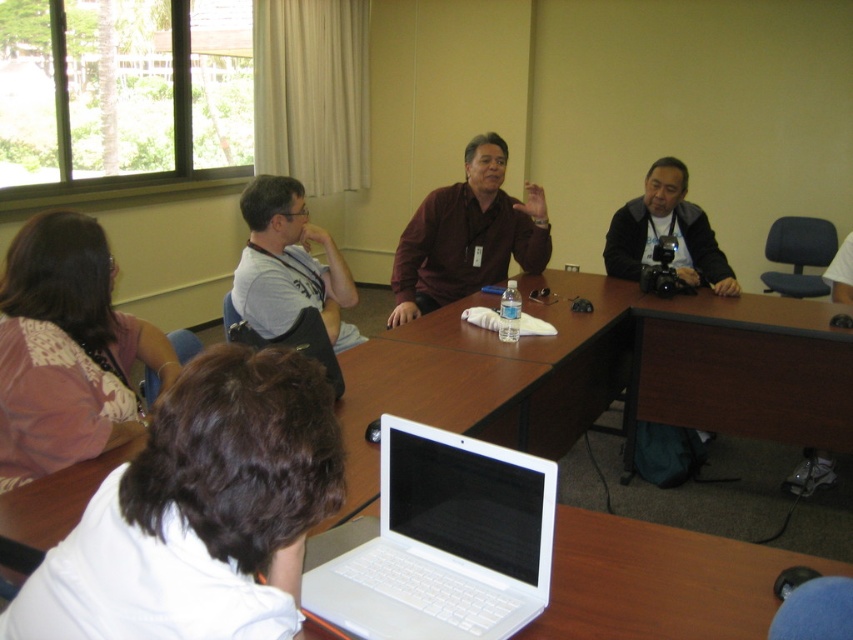
Is pink floral blouse at lower left further to the viewer compared to white matte t-shirt at center?

That is False.

Is point (3, 460) positioned behind point (251, 248)?

No, it is in front of (251, 248).

What do you see at coordinates (67, 349) in the screenshot? The image size is (853, 640). I see `pink floral blouse at lower left` at bounding box center [67, 349].

Where is `pink floral blouse at lower left`? pink floral blouse at lower left is located at coordinates (67, 349).

Does white plastic laptop at center have a lesser height compared to pink floral blouse at lower left?

Indeed, white plastic laptop at center has a lesser height compared to pink floral blouse at lower left.

What are the coordinates of `white plastic laptop at center` in the screenshot? It's located at (444, 541).

Where is `white plastic laptop at center`? The width and height of the screenshot is (853, 640). white plastic laptop at center is located at coordinates (444, 541).

Can you confirm if white matte shirt at lower left is positioned above white matte t-shirt at center?

No.

Which is behind, point (216, 476) or point (247, 193)?

Positioned behind is point (247, 193).

Is point (215, 413) in front of point (281, 196)?

Yes.

Locate an element on the screen. white matte shirt at lower left is located at coordinates (199, 513).